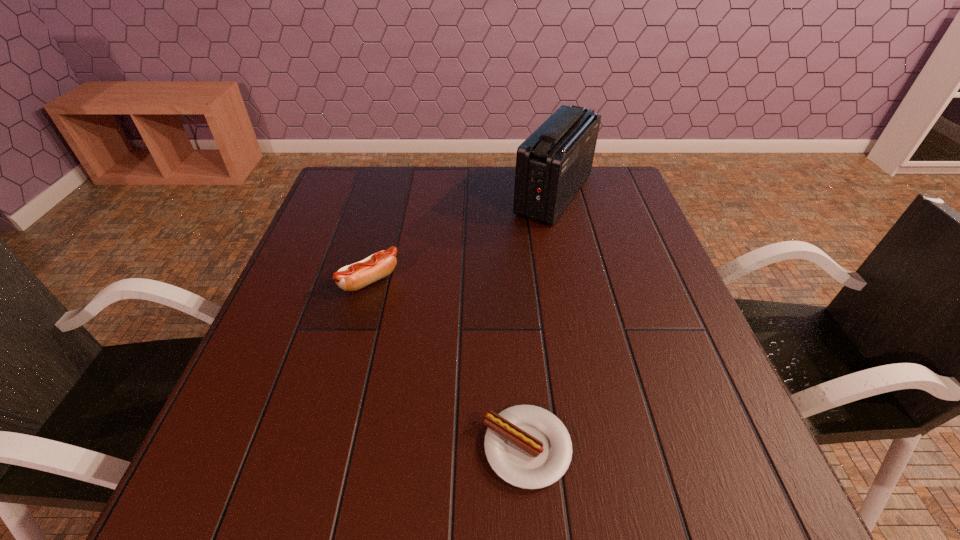
At what (x,y) coordinates should I click in order to perform the action: click on radio receiver. Please return your answer as a coordinate pair (x, y). Looking at the image, I should click on (552, 164).

Identify the location of the tallest object. The image size is (960, 540). (552, 164).

Identify the location of the farther sausage. The width and height of the screenshot is (960, 540). (353, 277).

Where is `the second shortest object`? The width and height of the screenshot is (960, 540). the second shortest object is located at coordinates (353, 277).

In order to click on the shorter sausage in this screenshot , I will do `click(527, 446)`.

I want to click on the nearest object, so click(x=527, y=446).

You are a GUI agent. You are given a task and a screenshot of the screen. Output one action in this format:
    pyautogui.click(x=<x>, y=<y>)
    Task: Click on the vacant space located on the front panel of the radio receiver
    The width and height of the screenshot is (960, 540).
    Given the screenshot: What is the action you would take?
    coord(404,195)

Identify the location of vacant area located 0.380m on the front panel of the radio receiver. (384, 195).

Where is `free space located on the front panel of the radio receiver`? free space located on the front panel of the radio receiver is located at coordinates (397, 195).

In order to click on vacant position located 0.130m on the back of the second shortest object in this screenshot , I will do 382,232.